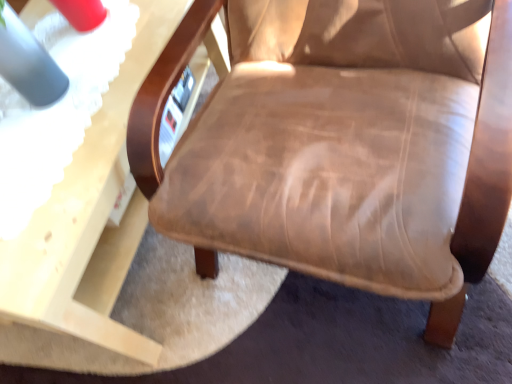
This screenshot has height=384, width=512. In order to click on leather-like brown chair at center in this screenshot , I will do `click(342, 144)`.

What do you see at coordinates (342, 144) in the screenshot? The image size is (512, 384). I see `leather-like brown chair at center` at bounding box center [342, 144].

I want to click on matte wood table at lower left, so pos(90,219).

The image size is (512, 384). What do you see at coordinates (90, 219) in the screenshot?
I see `matte wood table at lower left` at bounding box center [90, 219].

The image size is (512, 384). Find the location of `leather-like brown chair at center`. leather-like brown chair at center is located at coordinates (342, 144).

Which is more to the right, leather-like brown chair at center or matte wood table at lower left?

leather-like brown chair at center is more to the right.

Does leather-like brown chair at center come in front of matte wood table at lower left?

Yes, leather-like brown chair at center is closer to the viewer.

Which is behind, point (324, 32) or point (16, 252)?

The point (324, 32) is farther from the camera.

From the image's perspective, is leather-like brown chair at center located beneath matte wood table at lower left?

No, from the image's perspective, leather-like brown chair at center is not below matte wood table at lower left.

From a real-world perspective, between leather-like brown chair at center and matte wood table at lower left, who is vertically higher?

leather-like brown chair at center is physically above.

Between leather-like brown chair at center and matte wood table at lower left, which one has smaller width?

With smaller width is leather-like brown chair at center.

Considering the sizes of objects leather-like brown chair at center and matte wood table at lower left in the image provided, who is taller, leather-like brown chair at center or matte wood table at lower left?

leather-like brown chair at center.

Between leather-like brown chair at center and matte wood table at lower left, which one has larger size?

leather-like brown chair at center is bigger.

Consider the image. Is leather-like brown chair at center completely or partially outside of matte wood table at lower left?

Yes, leather-like brown chair at center is outside of matte wood table at lower left.

Is leather-like brown chair at center positioned far away from matte wood table at lower left?

No, leather-like brown chair at center is in close proximity to matte wood table at lower left.

Is leather-like brown chair at center facing away from matte wood table at lower left?

leather-like brown chair at center is not turned away from matte wood table at lower left.

How different are the orientations of leather-like brown chair at center and matte wood table at lower left in degrees?

The facing directions of leather-like brown chair at center and matte wood table at lower left are 4.09 degrees apart.

How distant is leather-like brown chair at center from matte wood table at lower left?

leather-like brown chair at center and matte wood table at lower left are 12.15 inches apart.

At what (x,y) coordinates should I click in order to perform the action: click on table below the leather-like brown chair at center (from the image's perspective). Please return your answer as a coordinate pair (x, y). The image size is (512, 384). Looking at the image, I should click on (90, 219).

In the scene shown: Considering the positions of objects matte wood table at lower left and leather-like brown chair at center in the image provided, who is more to the left, matte wood table at lower left or leather-like brown chair at center?

matte wood table at lower left is more to the left.

Considering the positions of objects matte wood table at lower left and leather-like brown chair at center in the image provided, who is behind, matte wood table at lower left or leather-like brown chair at center?

Positioned behind is matte wood table at lower left.

Between point (221, 74) and point (419, 140), which one is positioned behind?

Positioned behind is point (221, 74).

From the image's perspective, who appears lower, matte wood table at lower left or leather-like brown chair at center?

matte wood table at lower left.

From a real-world perspective, is matte wood table at lower left over leather-like brown chair at center?

No.

Can you confirm if matte wood table at lower left is wider than leather-like brown chair at center?

Yes.

Who is taller, matte wood table at lower left or leather-like brown chair at center?

Standing taller between the two is leather-like brown chair at center.

Who is smaller, matte wood table at lower left or leather-like brown chair at center?

matte wood table at lower left.

Is leather-like brown chair at center surrounded by matte wood table at lower left?

No, leather-like brown chair at center is not a part of matte wood table at lower left.

Is there a large distance between matte wood table at lower left and leather-like brown chair at center?

matte wood table at lower left is actually quite close to leather-like brown chair at center.

Does matte wood table at lower left turn towards leather-like brown chair at center?

No, matte wood table at lower left is not aimed at leather-like brown chair at center.

How different are the orientations of matte wood table at lower left and leather-like brown chair at center in degrees?

The facing directions of matte wood table at lower left and leather-like brown chair at center are 4.09 degrees apart.

You are a GUI agent. You are given a task and a screenshot of the screen. Output one action in this format:
    pyautogui.click(x=<x>, y=<y>)
    Task: Click on the chair above the matte wood table at lower left (from a real-world perspective)
    Image resolution: width=512 pixels, height=384 pixels.
    Given the screenshot: What is the action you would take?
    pyautogui.click(x=342, y=144)

Where is `chair on the right of matte wood table at lower left`? chair on the right of matte wood table at lower left is located at coordinates (342, 144).

Identify the location of table below the leather-like brown chair at center (from the image's perspective). The width and height of the screenshot is (512, 384). pyautogui.click(x=90, y=219).